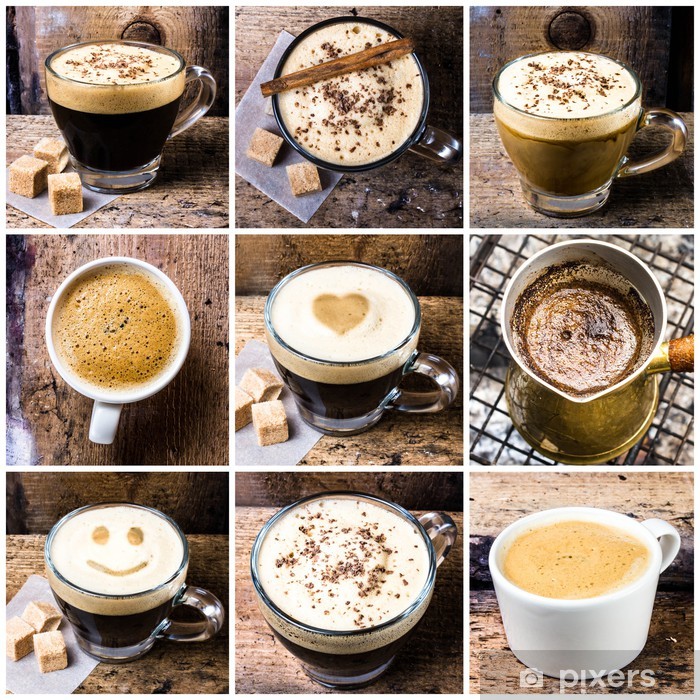
In order to click on cups in this screenshot , I will do `click(122, 115)`, `click(354, 104)`, `click(554, 113)`, `click(589, 351)`, `click(344, 336)`, `click(113, 346)`, `click(110, 566)`, `click(346, 575)`, `click(570, 580)`.